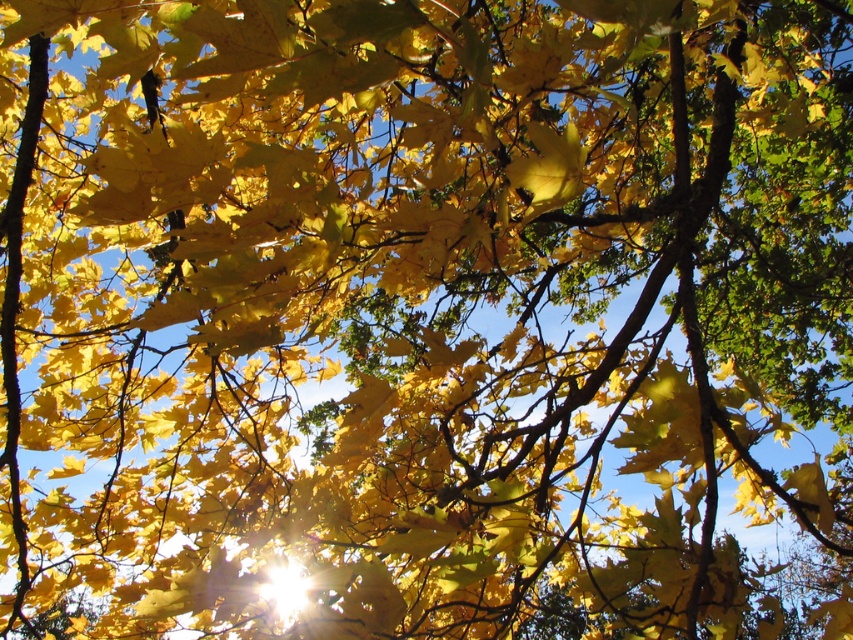
Measure the distance from yellow matte leaf at upper left to yellow matte leaf at center.

yellow matte leaf at upper left is 21.28 inches away from yellow matte leaf at center.

Does yellow matte leaf at upper left lie in front of yellow matte leaf at center?

No, it is behind yellow matte leaf at center.

Who is more distant from viewer, (99, 212) or (556, 140)?

The point (99, 212) is behind.

Where is `yellow matte leaf at upper left`? Image resolution: width=853 pixels, height=640 pixels. yellow matte leaf at upper left is located at coordinates (152, 173).